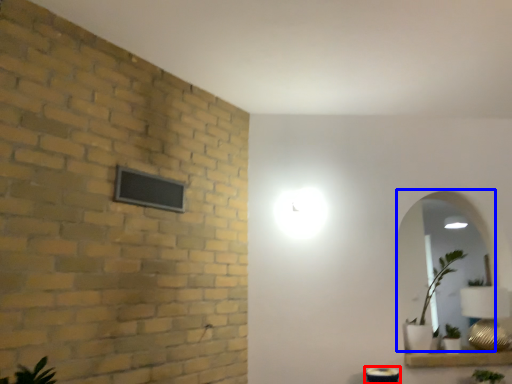
Question: Among these objects, which one is farthest to the camera, table (highlighted by a red box) or mirror (highlighted by a blue box)?

Choices:
 (A) table
 (B) mirror

Answer: (B)